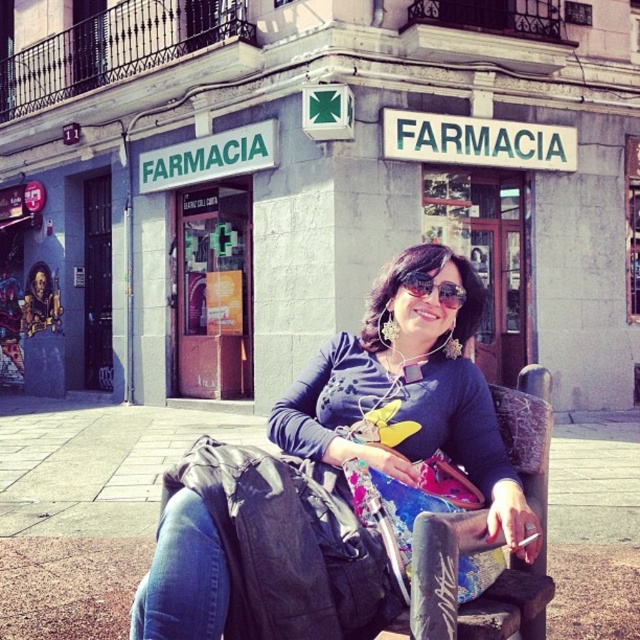
Is denim at lower left thinner than sunglasses at center?

No, denim at lower left is not thinner than sunglasses at center.

What do you see at coordinates (182, 577) in the screenshot?
I see `denim at lower left` at bounding box center [182, 577].

This screenshot has height=640, width=640. What are the coordinates of `denim at lower left` in the screenshot? It's located at (182, 577).

Can you confirm if matte black jacket at center is shorter than denim at lower left?

In fact, matte black jacket at center may be taller than denim at lower left.

Is matte black jacket at center wider than denim at lower left?

Indeed, matte black jacket at center has a greater width compared to denim at lower left.

Locate an element on the screen. matte black jacket at center is located at coordinates pyautogui.click(x=337, y=480).

Identify the location of matte black jacket at center. Image resolution: width=640 pixels, height=640 pixels. (337, 480).

Between point (406, 394) and point (452, 300), which one is positioned behind?

Positioned behind is point (406, 394).

Does point (408, 419) come closer to viewer compared to point (458, 305)?

Yes, point (408, 419) is closer to viewer.

You are a GUI agent. You are given a task and a screenshot of the screen. Output one action in this format:
    pyautogui.click(x=<x>, y=<y>)
    Task: Click on the matte black jacket at center
    
    Given the screenshot: What is the action you would take?
    pyautogui.click(x=337, y=480)